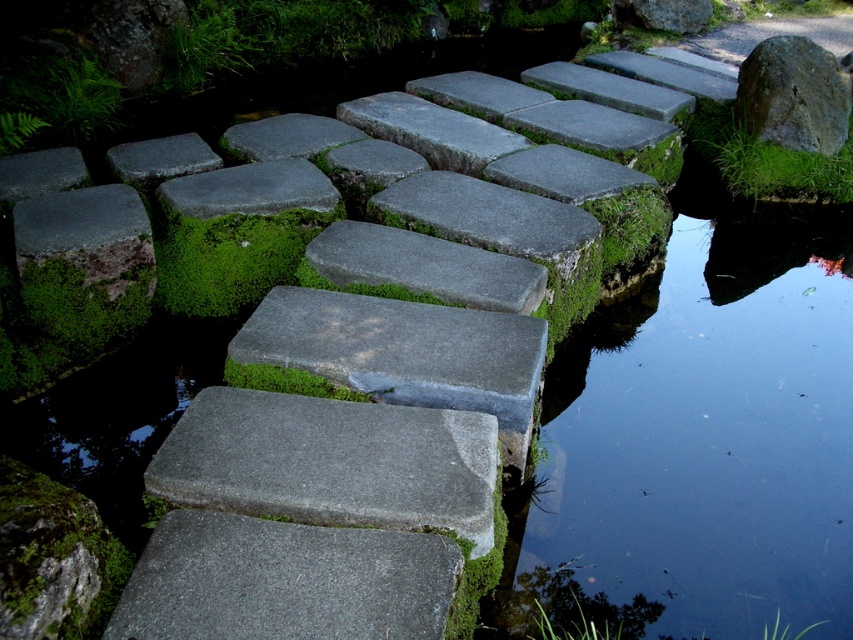
Question: Does green mossy stone at center come behind gray rough rock at upper right?

Choices:
 (A) no
 (B) yes

Answer: (A)

Question: Is green mossy stone at center below gray rough rock at upper right?

Choices:
 (A) yes
 (B) no

Answer: (A)

Question: Which of the following is the farthest from the observer?

Choices:
 (A) (837, 141)
 (B) (229, 266)

Answer: (A)

Question: Which of the following is the farthest from the observer?

Choices:
 (A) green mossy stone at center
 (B) gray rough rock at upper right

Answer: (B)

Question: Which point is farther from the camera taking this photo?

Choices:
 (A) (820, 109)
 (B) (254, 288)

Answer: (A)

Question: Does green mossy stone at center appear on the right side of gray rough rock at upper right?

Choices:
 (A) no
 (B) yes

Answer: (A)